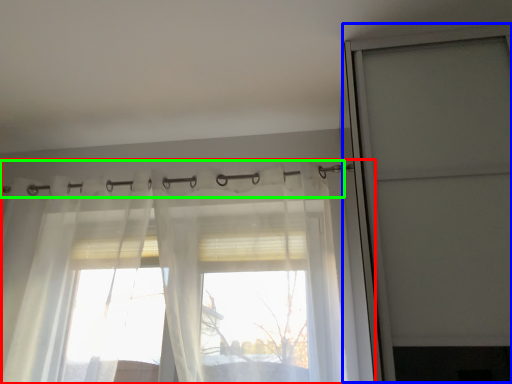
Question: Based on their relative distances, which object is nearer to curtain (highlighted by a red box)? Choose from screen door (highlighted by a blue box) and clothesline (highlighted by a green box).

Choices:
 (A) screen door
 (B) clothesline

Answer: (B)